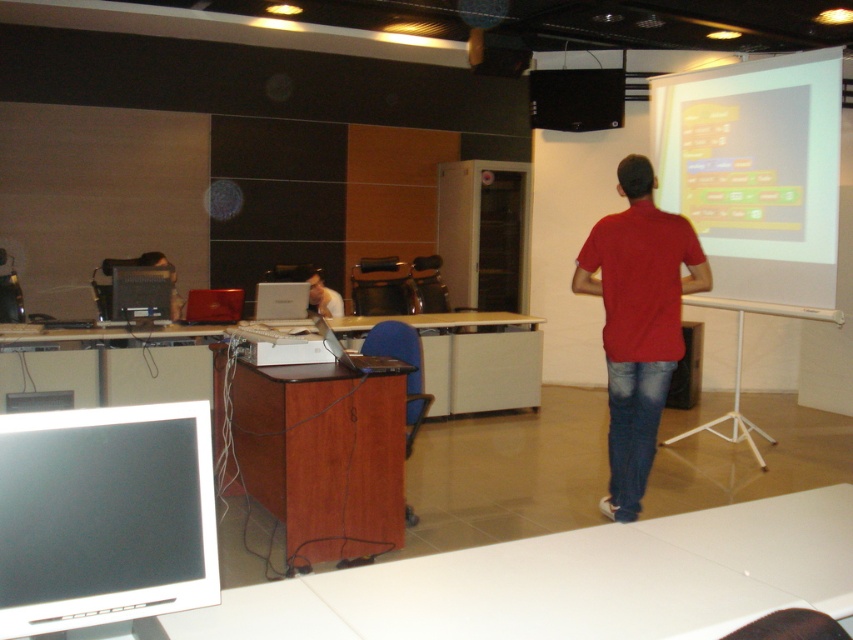
Between black glossy monitor at lower left and matte black monitor at center, which one is positioned higher?

matte black monitor at center

Can you confirm if black glossy monitor at lower left is thinner than matte black monitor at center?

Incorrect, black glossy monitor at lower left's width is not less than matte black monitor at center's.

This screenshot has height=640, width=853. Describe the element at coordinates (97, 509) in the screenshot. I see `black glossy monitor at lower left` at that location.

The width and height of the screenshot is (853, 640). Identify the location of black glossy monitor at lower left. 97,509.

Which of these two, white matte projection screen at upper right or matte black monitor at center, stands shorter?

Standing shorter between the two is matte black monitor at center.

Does white matte projection screen at upper right have a smaller size compared to matte black monitor at center?

Actually, white matte projection screen at upper right might be larger than matte black monitor at center.

Who is more forward, (680, 109) or (175, 289)?

Point (680, 109)

The image size is (853, 640). I want to click on white matte projection screen at upper right, so click(x=755, y=172).

Is point (115, 310) positioned before point (149, 253)?

Yes, point (115, 310) is closer to viewer.

This screenshot has width=853, height=640. What do you see at coordinates (141, 292) in the screenshot?
I see `black plastic monitor at left` at bounding box center [141, 292].

This screenshot has height=640, width=853. What are the coordinates of `black plastic monitor at left` in the screenshot? It's located at (141, 292).

Locate an element on the screen. The width and height of the screenshot is (853, 640). black plastic monitor at left is located at coordinates (141, 292).